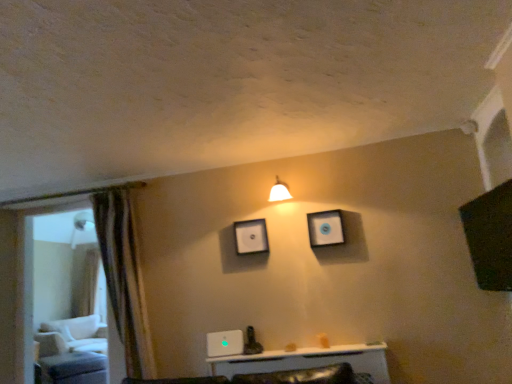
Where is `brown velvet curtain at left`? Image resolution: width=512 pixels, height=384 pixels. brown velvet curtain at left is located at coordinates (122, 275).

This screenshot has width=512, height=384. What do you see at coordinates (325, 228) in the screenshot?
I see `matte white picture frame at upper center, which is counted as the first picture frame, starting from the right` at bounding box center [325, 228].

Where is `transparent glass door at left`? The image size is (512, 384). transparent glass door at left is located at coordinates (69, 291).

What are the coordinates of `matte black picture frame at upper center, the 2th picture frame in the right-to-left sequence` in the screenshot? It's located at (251, 236).

What do you see at coordinates (73, 336) in the screenshot? This screenshot has width=512, height=384. I see `white fabric swivel chair at left` at bounding box center [73, 336].

The height and width of the screenshot is (384, 512). Find the location of `brown velvet curtain at left`. brown velvet curtain at left is located at coordinates (122, 275).

In the scene shown: Measure the distance from white fabric swivel chair at left to matte black ottoman at lower left.

white fabric swivel chair at left is 9.09 inches from matte black ottoman at lower left.

Considering the positions of objects white fabric swivel chair at left and matte black ottoman at lower left in the image provided, who is behind, white fabric swivel chair at left or matte black ottoman at lower left?

white fabric swivel chair at left is further from the camera.

Is point (88, 320) closer to camera compared to point (42, 356)?

No.

Considering the sizes of objects white fabric swivel chair at left and matte black ottoman at lower left in the image provided, who is smaller, white fabric swivel chair at left or matte black ottoman at lower left?

Smaller between the two is matte black ottoman at lower left.

Is brown velvet curtain at left in front of or behind matte black ottoman at lower left in the image?

brown velvet curtain at left is in front of matte black ottoman at lower left.

How different are the orientations of brown velvet curtain at left and matte black ottoman at lower left in degrees?

The angular difference between brown velvet curtain at left and matte black ottoman at lower left is 50 degrees.

Is brown velvet curtain at left with matte black ottoman at lower left?

No, brown velvet curtain at left is not making contact with matte black ottoman at lower left.

Which point is more distant from viewer, (127, 370) or (61, 342)?

The point (61, 342) is farther.

Who is shorter, transparent glass door at left or white glossy light fixture at upper center?

Standing shorter between the two is white glossy light fixture at upper center.

Considering the sizes of transparent glass door at left and white glossy light fixture at upper center in the image, is transparent glass door at left bigger or smaller than white glossy light fixture at upper center?

transparent glass door at left is bigger than white glossy light fixture at upper center.

In the image, is transparent glass door at left on the left side or the right side of white glossy light fixture at upper center?

transparent glass door at left is to the left of white glossy light fixture at upper center.

Based on the photo, is transparent glass door at left completely or partially outside of white glossy light fixture at upper center?

Absolutely, transparent glass door at left is external to white glossy light fixture at upper center.

Which point is more forward, (x=327, y=227) or (x=98, y=207)?

Positioned in front is point (x=327, y=227).

In terms of width, does matte white picture frame at upper center, arranged as the second picture frame when viewed from the left, look wider or thinner when compared to brown velvet curtain at left?

Clearly, matte white picture frame at upper center, arranged as the second picture frame when viewed from the left, has less width compared to brown velvet curtain at left.

From the image's perspective, is matte white picture frame at upper center, the 1th picture frame viewed from the front, under brown velvet curtain at left?

No, from the image's perspective, matte white picture frame at upper center, the 1th picture frame viewed from the front, is not beneath brown velvet curtain at left.

From a real-world perspective, is matte white picture frame at upper center, the 1th picture frame viewed from the front, on top of brown velvet curtain at left?

Correct, in the physical world, matte white picture frame at upper center, the 1th picture frame viewed from the front, is higher than brown velvet curtain at left.

Is white fabric swivel chair at left inside the boundaries of transparent glass door at left, or outside?

white fabric swivel chair at left is outside transparent glass door at left.

Consider the image. Considering the sizes of objects white fabric swivel chair at left and transparent glass door at left in the image provided, who is thinner, white fabric swivel chair at left or transparent glass door at left?

transparent glass door at left is thinner.

From the image's perspective, is white fabric swivel chair at left positioned above or below transparent glass door at left?

From the image's perspective, white fabric swivel chair at left appears below transparent glass door at left.

Does white fabric swivel chair at left have a lesser height compared to transparent glass door at left?

Yes.

Is transparent glass door at left completely or partially outside of matte white picture frame at upper center, the 1th picture frame viewed from the front?

Yes.

Which is further, (56,323) or (324,212)?

The point (56,323) is more distant.

Between transparent glass door at left and matte white picture frame at upper center, arranged as the second picture frame when viewed from the left, which one appears on the right side from the viewer's perspective?

matte white picture frame at upper center, arranged as the second picture frame when viewed from the left, is more to the right.

From a real-world perspective, is transparent glass door at left below matte white picture frame at upper center, arranged as the second picture frame when viewed from the left?

Correct, in the physical world, transparent glass door at left is lower than matte white picture frame at upper center, arranged as the second picture frame when viewed from the left.

Between matte black ottoman at lower left and transparent glass door at left, which one has smaller size?

Smaller between the two is transparent glass door at left.

How different are the orientations of matte black ottoman at lower left and transparent glass door at left in degrees?

51.6 degrees separate the facing orientations of matte black ottoman at lower left and transparent glass door at left.

Is matte black ottoman at lower left turned away from transparent glass door at left?

That's not correct — matte black ottoman at lower left is not looking away from transparent glass door at left.

Between matte black ottoman at lower left and transparent glass door at left, which one has larger width?

With larger width is matte black ottoman at lower left.

Locate an element on the screen. Image resolution: width=512 pixels, height=384 pixels. furniture that is under the white fabric swivel chair at left (from a real-world perspective) is located at coordinates (69, 362).

Locate an element on the screen. The width and height of the screenshot is (512, 384). curtain that appears above the matte black ottoman at lower left (from the image's perspective) is located at coordinates (122, 275).

Based on their spatial positions, is white glossy light fixture at upper center or matte white picture frame at upper center, which is counted as the second picture frame, starting from the back, further from white fabric swivel chair at left?

matte white picture frame at upper center, which is counted as the second picture frame, starting from the back.

Estimate the real-world distances between objects in this image. Which object is further from matte black ottoman at lower left, matte white picture frame at upper center, which is counted as the first picture frame, starting from the right, or brown velvet curtain at left?

matte white picture frame at upper center, which is counted as the first picture frame, starting from the right, is positioned further to the anchor matte black ottoman at lower left.

When comparing their distances from brown velvet curtain at left, does white glossy light fixture at upper center or transparent glass door at left seem closer?

white glossy light fixture at upper center is closer to brown velvet curtain at left.

From the image, which object appears to be nearer to white glossy light fixture at upper center, brown velvet curtain at left or matte white picture frame at upper center, arranged as the second picture frame when viewed from the left?

Based on the image, matte white picture frame at upper center, arranged as the second picture frame when viewed from the left, appears to be nearer to white glossy light fixture at upper center.

Considering their positions, is matte white picture frame at upper center, which is counted as the first picture frame, starting from the right, positioned closer to transparent glass door at left than brown velvet curtain at left?

brown velvet curtain at left lies closer to transparent glass door at left than the other object.

Looking at this image, considering their positions, is white fabric swivel chair at left positioned closer to matte black picture frame at upper center, the 2th picture frame in the right-to-left sequence, than transparent glass door at left?

Among the two, white fabric swivel chair at left is located nearer to matte black picture frame at upper center, the 2th picture frame in the right-to-left sequence.

Based on their spatial positions, is white glossy light fixture at upper center or brown velvet curtain at left further from white fabric swivel chair at left?

white glossy light fixture at upper center is positioned further to the anchor white fabric swivel chair at left.

Which object lies nearer to the anchor point white glossy light fixture at upper center, white fabric swivel chair at left or matte black picture frame at upper center, the 2th picture frame in the right-to-left sequence?

matte black picture frame at upper center, the 2th picture frame in the right-to-left sequence, is positioned closer to the anchor white glossy light fixture at upper center.

Find the location of `glass door positioned between white glossy light fixture at upper center and white fabric swivel chair at left from near to far`. glass door positioned between white glossy light fixture at upper center and white fabric swivel chair at left from near to far is located at coordinates (69, 291).

This screenshot has width=512, height=384. I want to click on light fixture between brown velvet curtain at left and matte white picture frame at upper center, arranged as the second picture frame when viewed from the left, in the horizontal direction, so coord(279,192).

At what (x,y) coordinates should I click in order to perform the action: click on curtain located between matte black ottoman at lower left and matte black picture frame at upper center, the first picture frame from the left, in the left-right direction. Please return your answer as a coordinate pair (x, y). Image resolution: width=512 pixels, height=384 pixels. Looking at the image, I should click on (122, 275).

Find the location of a particular element. Image resolution: width=512 pixels, height=384 pixels. glass door located between brown velvet curtain at left and matte black ottoman at lower left in the depth direction is located at coordinates (69, 291).